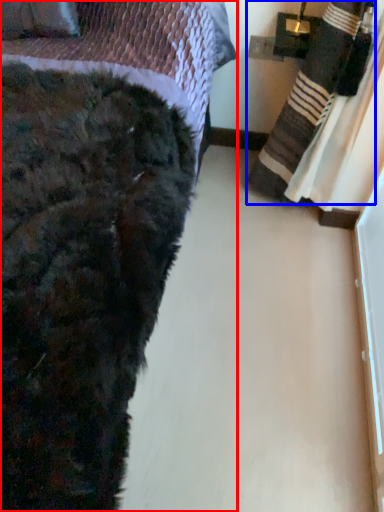
Question: Which of the following is the farthest to the observer, bed (highlighted by a red box) or blanket (highlighted by a blue box)?

Choices:
 (A) bed
 (B) blanket

Answer: (B)